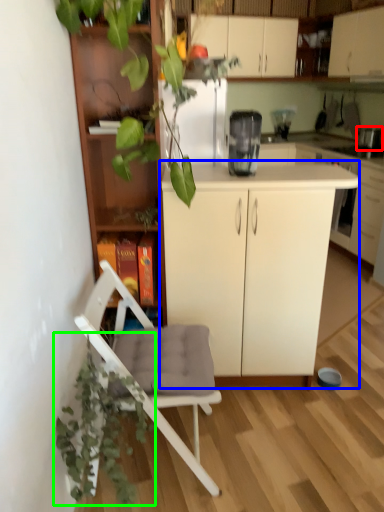
Question: Estimate the real-world distances between objects in this image. Which object is farther from appliance (highlighted by a red box), cabinetry (highlighted by a blue box) or vegetation (highlighted by a green box)?

Choices:
 (A) cabinetry
 (B) vegetation

Answer: (B)